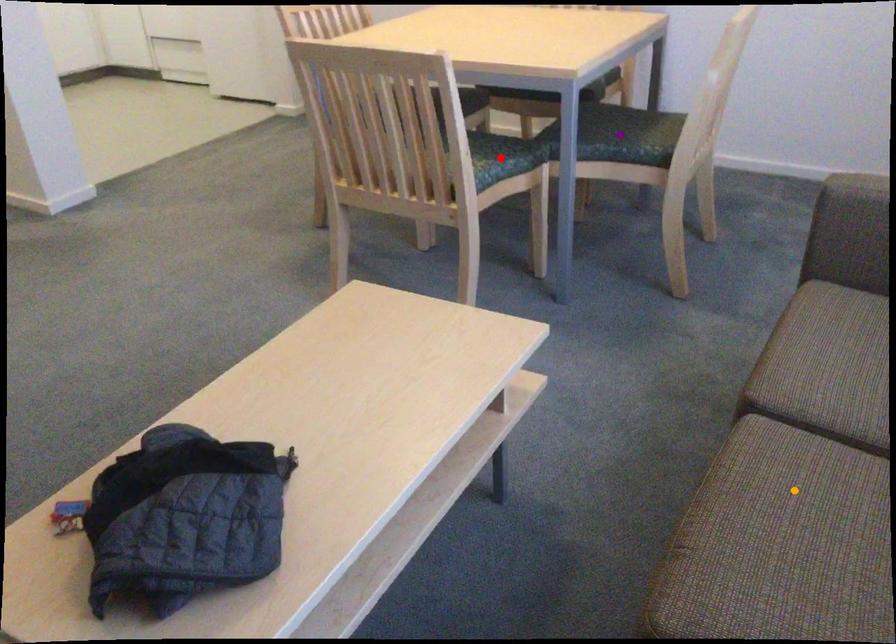
Order these from nearest to farthest:
red point
purple point
orange point

1. orange point
2. red point
3. purple point